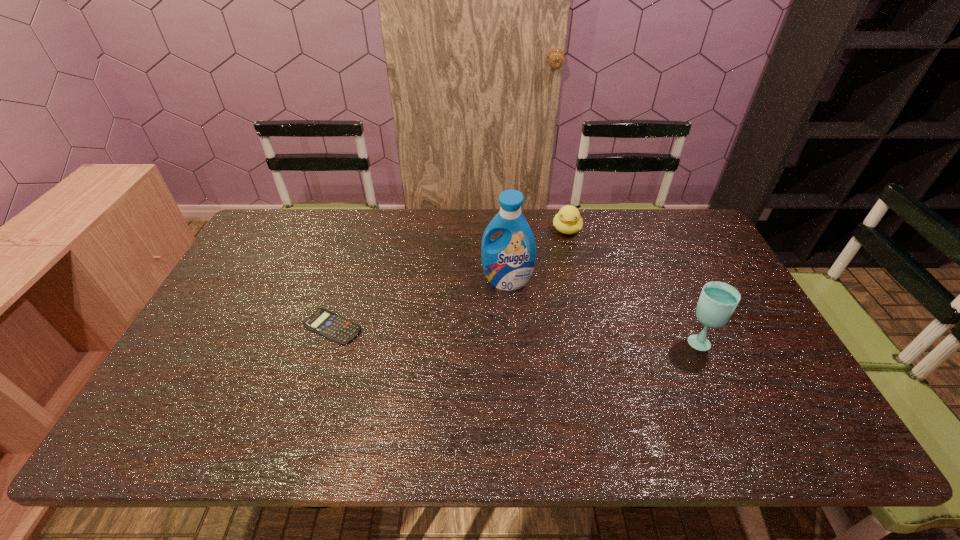
I want to click on free space that is in between the third nearest object and the glass, so click(602, 310).

Where is `vacant area that lies between the leftmost object and the duckling`? Image resolution: width=960 pixels, height=540 pixels. vacant area that lies between the leftmost object and the duckling is located at coordinates (x=449, y=278).

Identify the location of free area in between the rightmost object and the third tallest object. Image resolution: width=960 pixels, height=540 pixels. (633, 285).

Find the location of a particular element. This screenshot has height=540, width=960. vacant space in between the leftmost object and the glass is located at coordinates (516, 333).

Locate an element on the screen. object that is the second closest to the calculator is located at coordinates 568,220.

Identify which object is located as the second nearest to the glass. Please provide its 2D coordinates. Your answer should be formatted as a tuple, i.e. [(x, y)], where the tuple contains the x and y coordinates of a point satisfying the conditions above.

[(568, 220)]

The height and width of the screenshot is (540, 960). Identify the location of free spot that satisfies the following two spatial constraints: 1. on the front side of the rightmost object; 2. on the right side of the shortest object. (328, 340).

Where is `blank area in the image that satisfies the following two spatial constraints: 1. on the back side of the tallest object; 2. on the right side of the leftmost object`? blank area in the image that satisfies the following two spatial constraints: 1. on the back side of the tallest object; 2. on the right side of the leftmost object is located at coordinates (348, 281).

The height and width of the screenshot is (540, 960). Identify the location of vacant space that satisfies the following two spatial constraints: 1. on the back side of the third tallest object; 2. on the left side of the calculator. (364, 230).